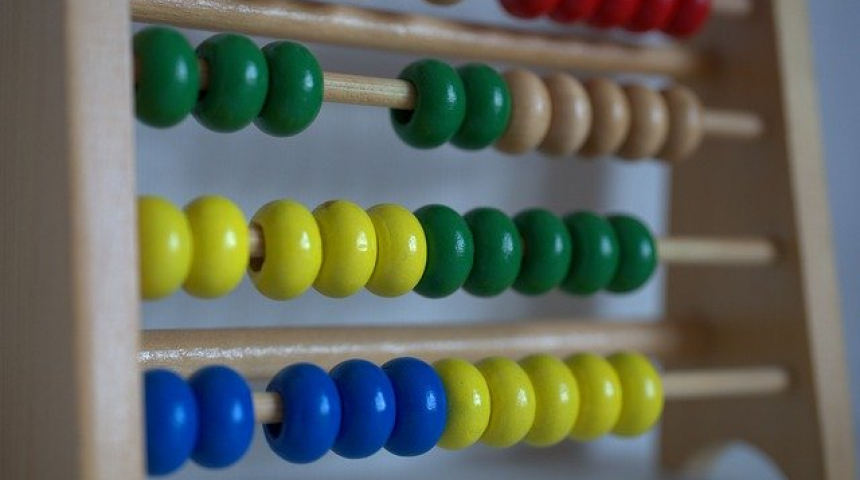
Find the location of a particular element. This screenshot has height=480, width=860. yellow abacus beads is located at coordinates (170, 235), (209, 253), (296, 254), (327, 256), (394, 255), (458, 388), (520, 403), (559, 398), (599, 395), (643, 390).